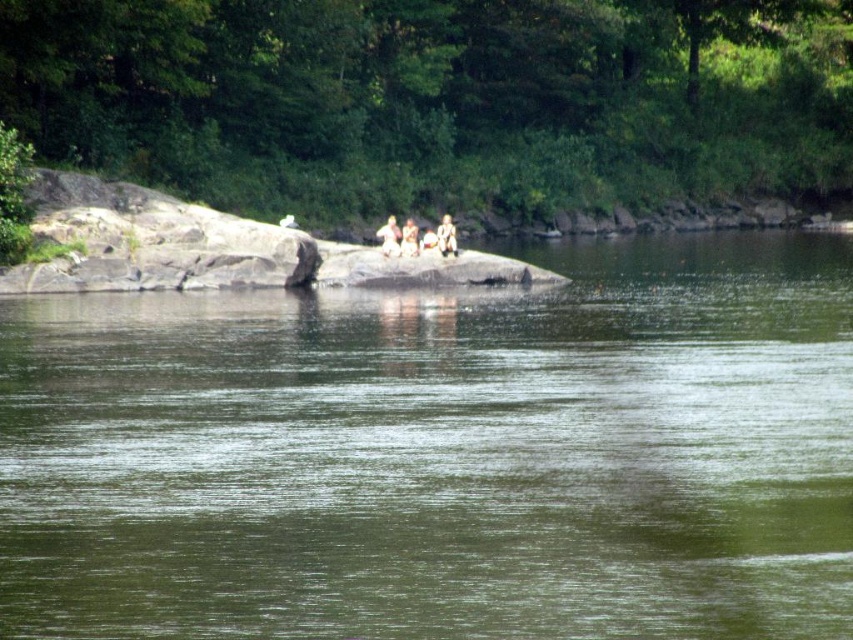
Is green smooth water at center to the left of camouflage fabric person at center from the viewer's perspective?

Correct, you'll find green smooth water at center to the left of camouflage fabric person at center.

The height and width of the screenshot is (640, 853). Find the location of `green smooth water at center`. green smooth water at center is located at coordinates (440, 452).

Does point (123, 445) come farther from viewer compared to point (437, 236)?

No.

Locate an element on the screen. green smooth water at center is located at coordinates (440, 452).

Can you confirm if green smooth water at center is thinner than blurred human figure at center?

No, green smooth water at center is not thinner than blurred human figure at center.

Does point (346, 356) come in front of point (412, 243)?

Yes.

What are the coordinates of `green smooth water at center` in the screenshot? It's located at (440, 452).

Does camouflage fabric person at center appear on the left side of blurred human figure at center?

Incorrect, camouflage fabric person at center is not on the left side of blurred human figure at center.

Does camouflage fabric person at center have a smaller size compared to blurred human figure at center?

No.

This screenshot has width=853, height=640. I want to click on camouflage fabric person at center, so click(445, 236).

Find the location of a particular element. camouflage fabric person at center is located at coordinates (445, 236).